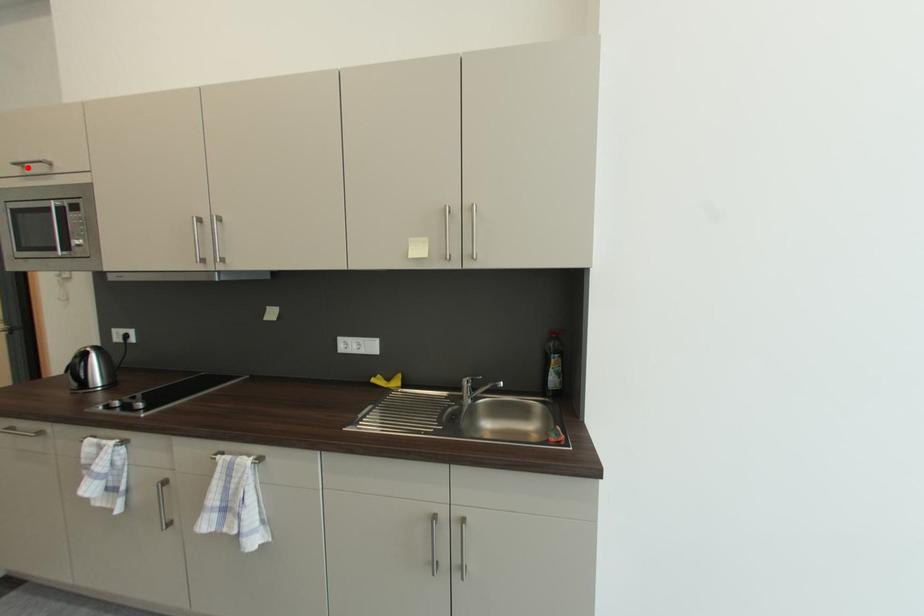
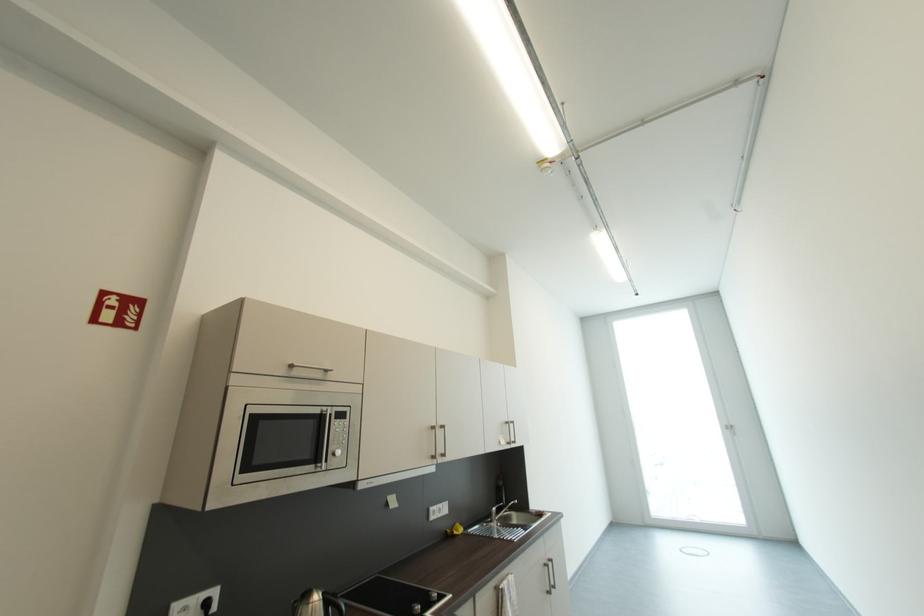
Question: I am providing you with two images of the same scene from different viewpoints. In image1, a red point is highlighted. Considering the same 3D point in image2, which of the following is correct?

Choices:
 (A) It is closer
 (B) It is farther

Answer: (A)